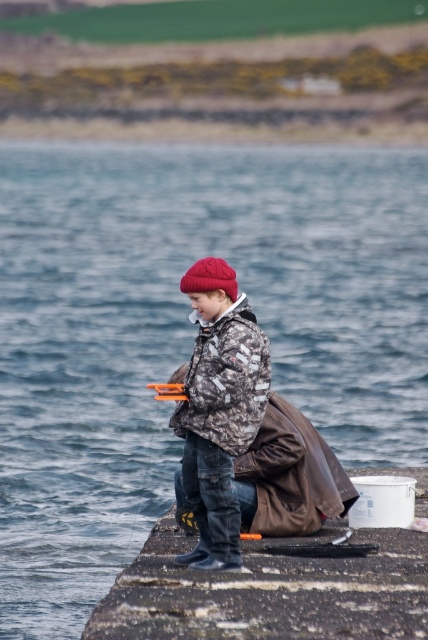
Question: Is camouflage jacket at center to the left of red woolen hat at center from the viewer's perspective?

Choices:
 (A) yes
 (B) no

Answer: (B)

Question: Which object is farther from the camera taking this photo?

Choices:
 (A) camouflage jacket at center
 (B) red woolen hat at center

Answer: (B)

Question: Can you confirm if camouflage jacket at center is bigger than red woolen hat at center?

Choices:
 (A) no
 (B) yes

Answer: (B)

Question: Can you confirm if camouflage jacket at center is positioned to the right of red woolen hat at center?

Choices:
 (A) yes
 (B) no

Answer: (A)